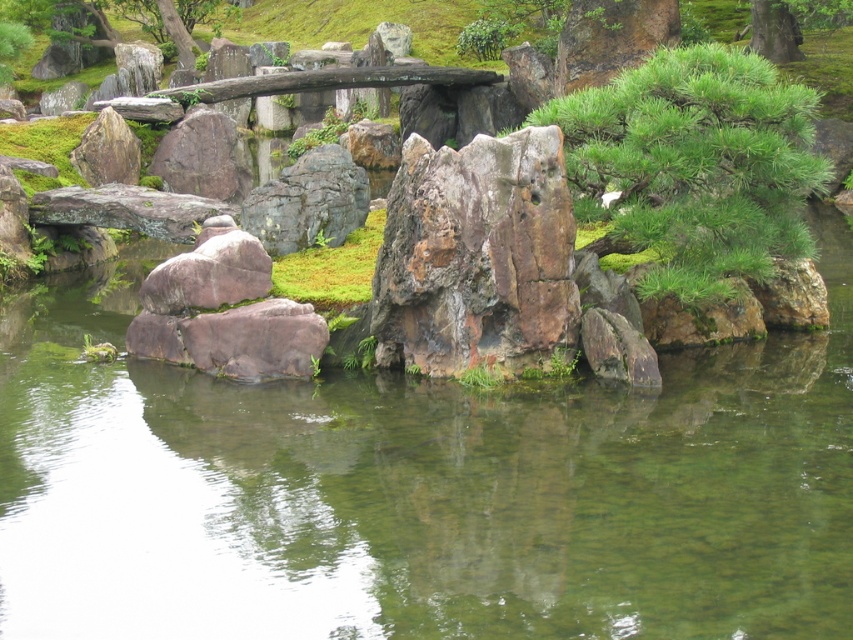
Question: Does rusty rock at center have a smaller size compared to rusty metallic rock at center?

Choices:
 (A) yes
 (B) no

Answer: (B)

Question: Is clear water at center thinner than rusty rock at center?

Choices:
 (A) no
 (B) yes

Answer: (A)

Question: Among these objects, which one is nearest to the camera?

Choices:
 (A) rusty rock at center
 (B) green textured pine tree at center right

Answer: (A)

Question: Which point is closer to the camera taking this photo?

Choices:
 (A) (695, 241)
 (B) (456, 216)

Answer: (B)

Question: Estimate the real-world distances between objects in this image. Which object is farther from the rusty metallic rock at center?

Choices:
 (A) green textured pine tree at center right
 (B) rusty rock at center
 (C) clear water at center

Answer: (C)

Question: Is clear water at center to the right of rusty rock at center from the viewer's perspective?

Choices:
 (A) yes
 (B) no

Answer: (B)